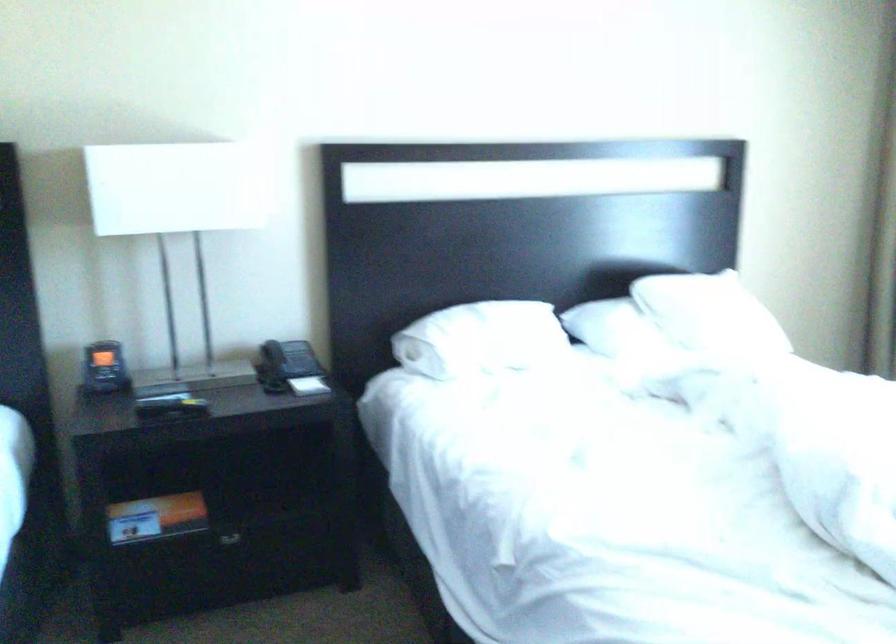
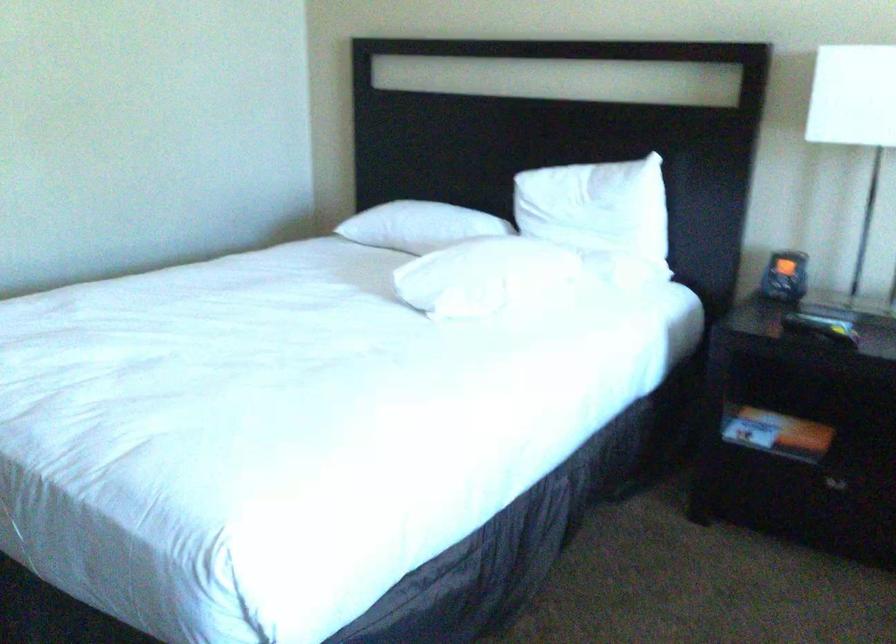
In the second image, find the point that corresponds to [135,527] in the first image.

(752, 427)